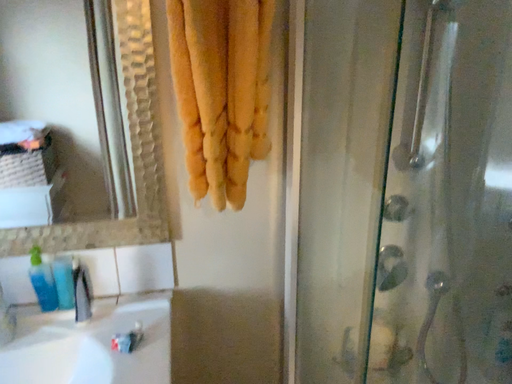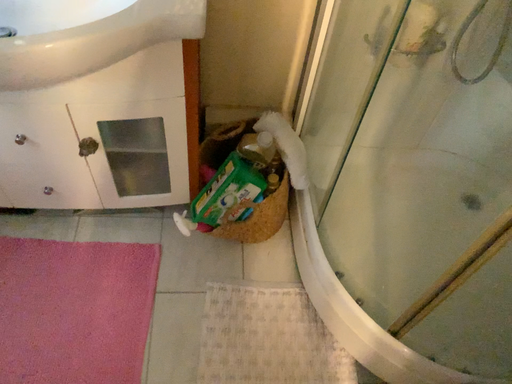
Question: Which way did the camera rotate in the video?

Choices:
 (A) rotated upward
 (B) rotated downward

Answer: (B)